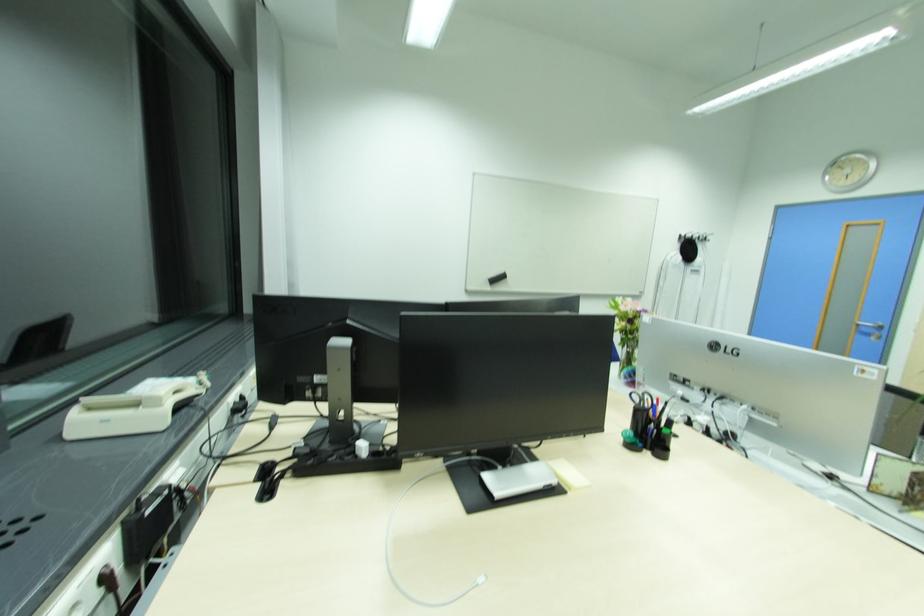
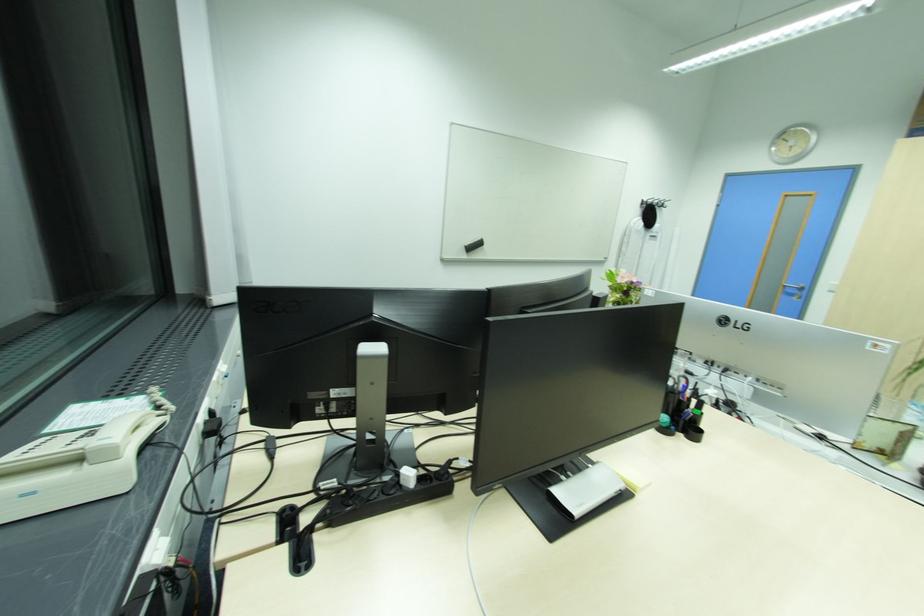
The point at (650, 448) is marked in the first image. Where is the corresponding point in the second image?

(683, 430)